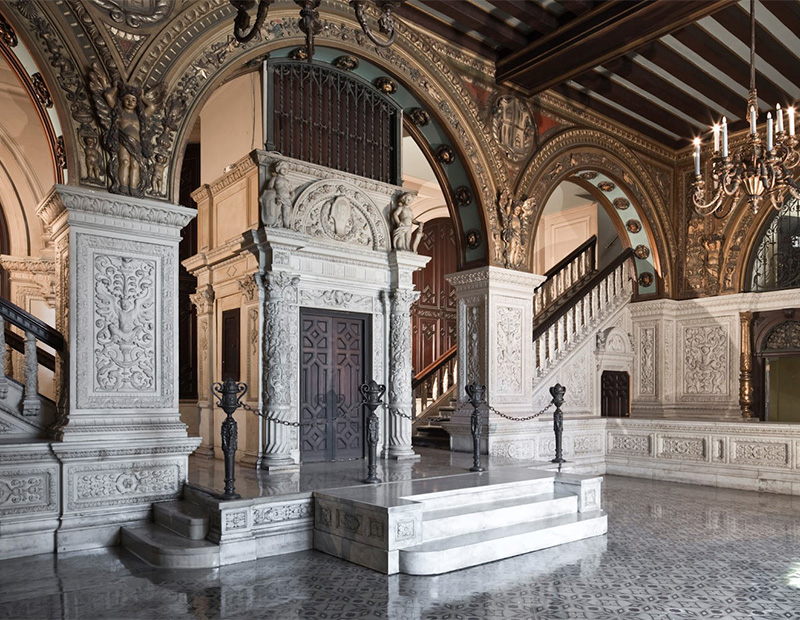
This screenshot has width=800, height=620. In order to click on surface of bottom marble step in this screenshot , I will do `click(501, 532)`, `click(145, 529)`.